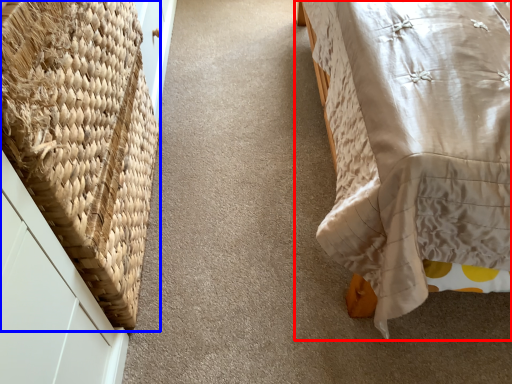
Question: Which point is further to the camera, furniture (highlighted by a red box) or basket (highlighted by a blue box)?

Choices:
 (A) furniture
 (B) basket

Answer: (B)